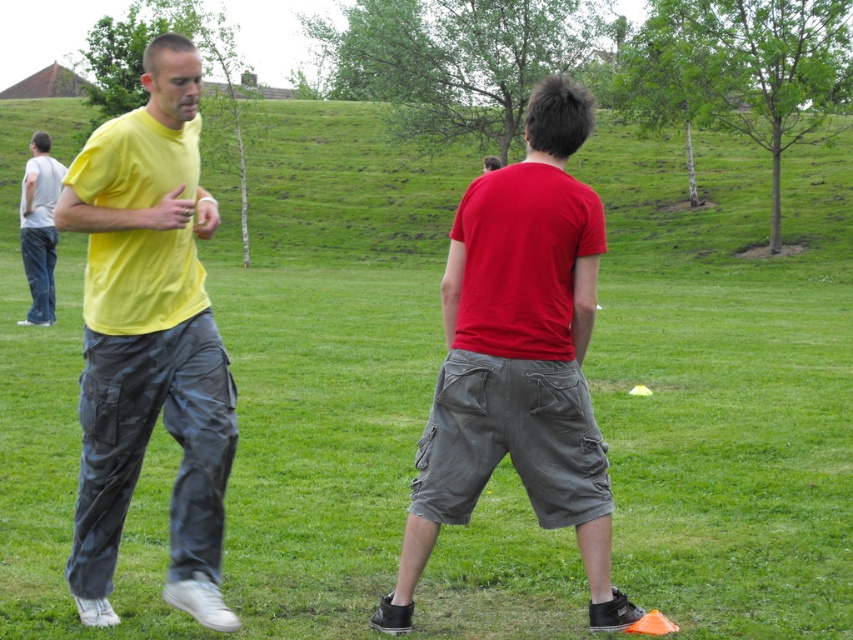
You are standing at the camera position and want to reach the point at coordinates [221,390]. If your walking speed is 1.5 meters per second, how many seconds will it take you to reach that point?

The distance of point [221,390] from camera is 4.83 meters. At a walking speed of 1.5 meters per second, it would take 4.83 divided by 1.5, which is approximately 3.22 seconds to reach the point.